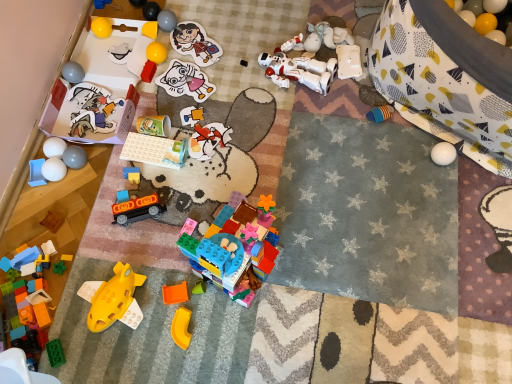
Identify the location of free space to the back side of matte blue plastic toy at center, acting as the thirteenth toy starting from the left. Image resolution: width=512 pixels, height=384 pixels. tap(143, 136).